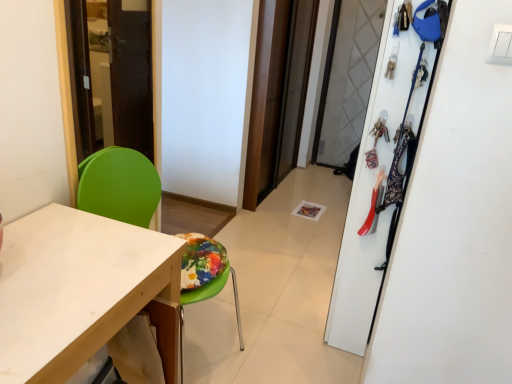
I want to click on free space that is in between transparent glass screen door at center and white matte closet at upper right, so click(x=300, y=237).